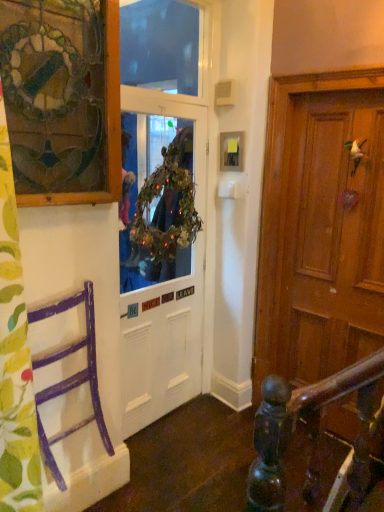
Image resolution: width=384 pixels, height=512 pixels. What are the coordinates of `vacant space underneath stained glass window at upper left, which is the 1th picture frame from left to right (from a real-world perspective)` in the screenshot? It's located at (62, 279).